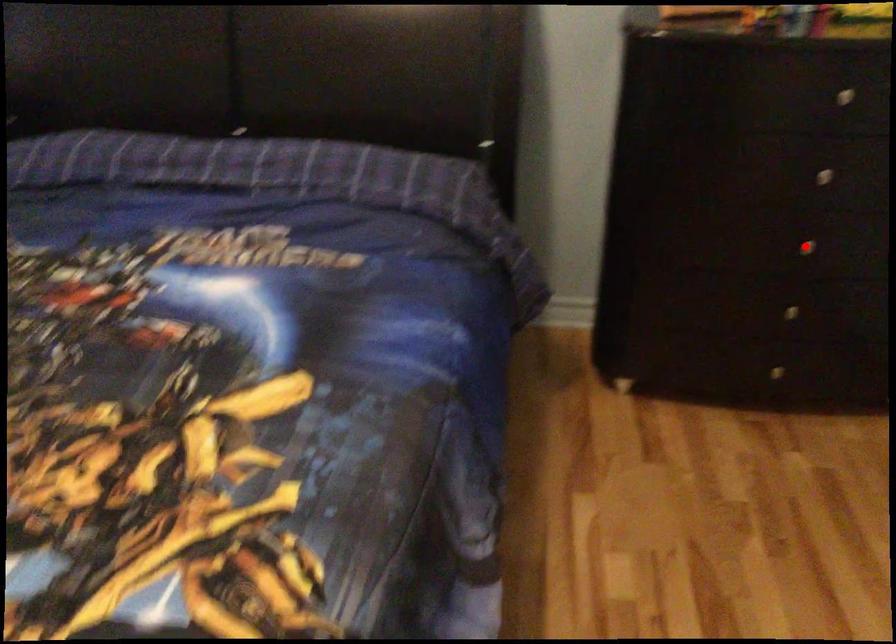
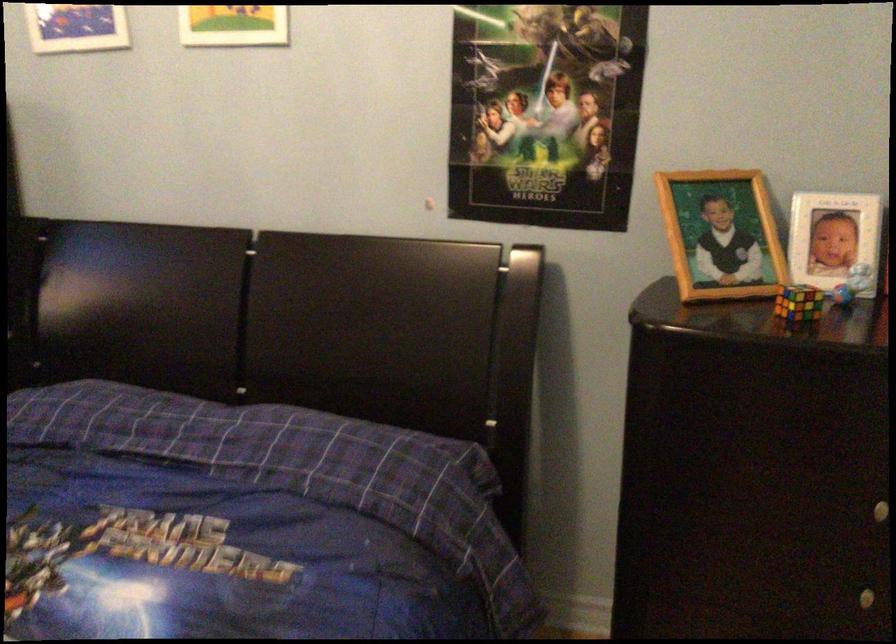
Question: A red point is marked in image1. In image2, is the corresponding 3D point closer to the camera or farther? Reply with the corresponding letter.

Choices:
 (A) The corresponding 3D point is closer.
 (B) The corresponding 3D point is farther.

Answer: (A)